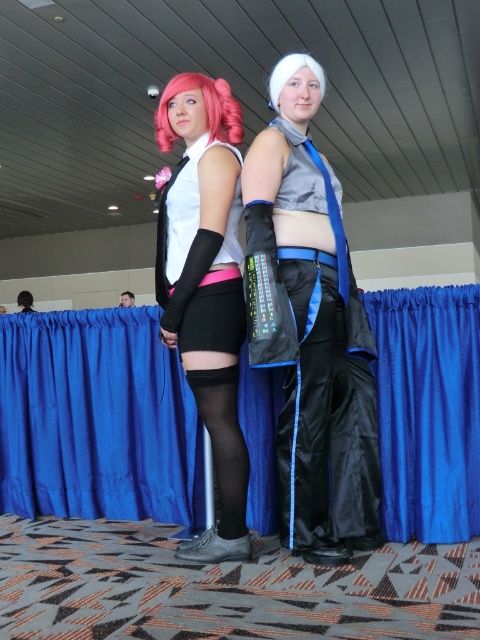
In the scene shown: Is shiny silver armor at center below pink synthetic wig at upper left?

Yes, shiny silver armor at center is below pink synthetic wig at upper left.

Does shiny silver armor at center have a smaller size compared to pink synthetic wig at upper left?

No, shiny silver armor at center is not smaller than pink synthetic wig at upper left.

You are a GUI agent. You are given a task and a screenshot of the screen. Output one action in this format:
    pyautogui.click(x=<x>, y=<y>)
    Task: Click on the shiny silver armor at center
    
    Given the screenshot: What is the action you would take?
    pyautogui.click(x=311, y=328)

Based on the photo, can you confirm if matte black skirt at center is shorter than pink synthetic wig at upper left?

Answer: No, matte black skirt at center is not shorter than pink synthetic wig at upper left.

Can you confirm if matte black skirt at center is positioned above pink synthetic wig at upper left?

No.

Find the location of `matte black skirt at center`. matte black skirt at center is located at coordinates (205, 284).

Find the location of a particular element. The height and width of the screenshot is (640, 480). matte black skirt at center is located at coordinates (205, 284).

Does black satin pants at center appear under matte black arm guard at center?

Yes.

Which is in front, point (302, 401) or point (201, 147)?

Point (302, 401) is in front.

Describe the element at coordinates (325, 419) in the screenshot. The width and height of the screenshot is (480, 640). I see `black satin pants at center` at that location.

Find the location of `black satin pants at center`. black satin pants at center is located at coordinates (325, 419).